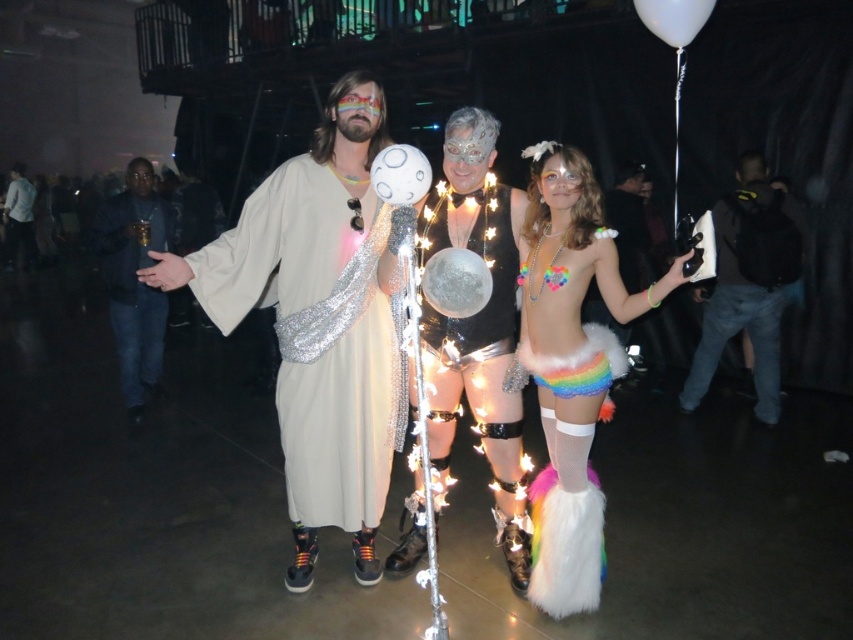
You are standing at the point marked as point [299,524] in the image. You want to walk straight to the exit located at the opposite end of the room. The exit is 5 meters away from your current position. Is the distance from your current position to the exit sufficient to reach it without needing to adjust your path?

The distance from your current position at point [299,524] to the exit is 5 meters, which is sufficient to reach it without needing to adjust your path since there is no mention of obstacles in the scene description.

You are a photographer at the event and need to capture a photo of both the white sequined robe at center and the white glossy balloon at center. The camera you are using has a minimum focus distance of 60 centimeters. Will you be able to take the photo without moving either object?

The distance between the white sequined robe at center and the white glossy balloon at center is 58.66 centimeters. Since the camera requires a minimum focus distance of 60 centimeters, you will need to move one of the objects slightly further apart to ensure proper focus.